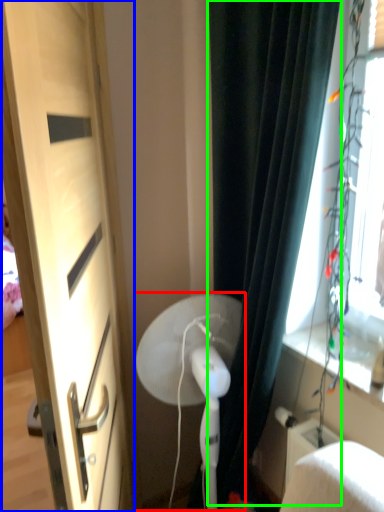
Question: Which object is positioned closest to fan (highlighted by a red box)? Select from door (highlighted by a blue box) and curtain (highlighted by a green box).

Choices:
 (A) door
 (B) curtain

Answer: (B)